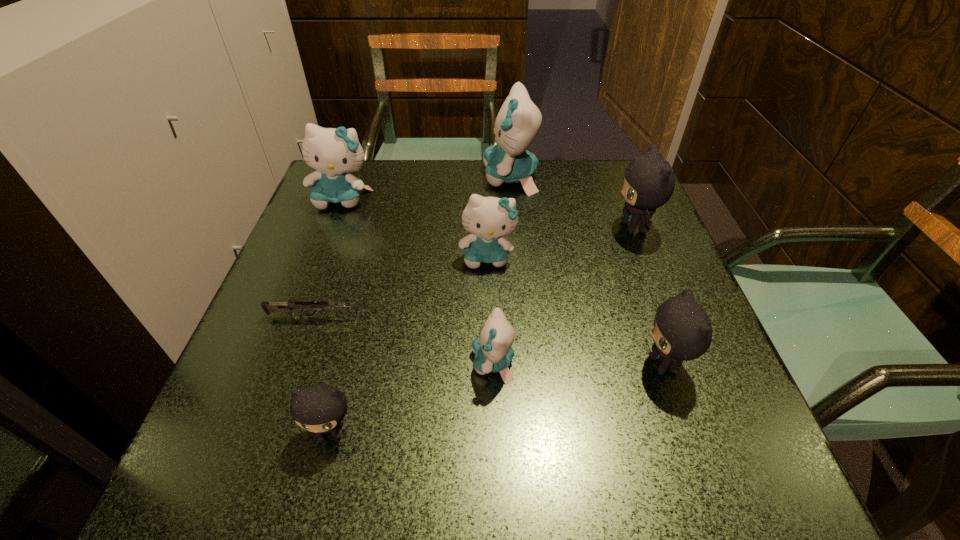
This screenshot has height=540, width=960. What are the coordinates of `vacant region located 0.160m on the front-facing side of the second nearest gray kitten` in the screenshot? It's located at (546, 364).

This screenshot has width=960, height=540. I want to click on vacant region located 0.180m on the front-facing side of the second nearest gray kitten, so click(535, 364).

Image resolution: width=960 pixels, height=540 pixels. Identify the location of vacant space located 0.050m on the face of the smallest blue kitten. (443, 363).

The image size is (960, 540). I want to click on vacant point located on the face of the smallest blue kitten, so click(x=391, y=363).

What are the coordinates of `blank space located 0.050m on the face of the smallest blue kitten` in the screenshot? It's located at (443, 363).

At what (x,y) coordinates should I click in order to perform the action: click on free space located 0.070m aimed along the barrel of the grey gun. Please return your answer as a coordinate pair (x, y). Looking at the image, I should click on (397, 317).

Where is `object that is positioned at the near edge`? The image size is (960, 540). object that is positioned at the near edge is located at coordinates (320, 408).

At what (x,y) coordinates should I click in order to perform the action: click on gun that is at the left edge. Please return your answer as a coordinate pair (x, y). Image resolution: width=960 pixels, height=540 pixels. Looking at the image, I should click on (287, 308).

You are a GUI agent. You are given a task and a screenshot of the screen. Output one action in this format:
    pyautogui.click(x=<x>, y=<y>)
    Task: Click on the object that is at the far left corner
    The image size is (960, 540).
    Given the screenshot: What is the action you would take?
    pyautogui.click(x=333, y=152)

I want to click on object positioned at the near left corner, so click(x=320, y=408).